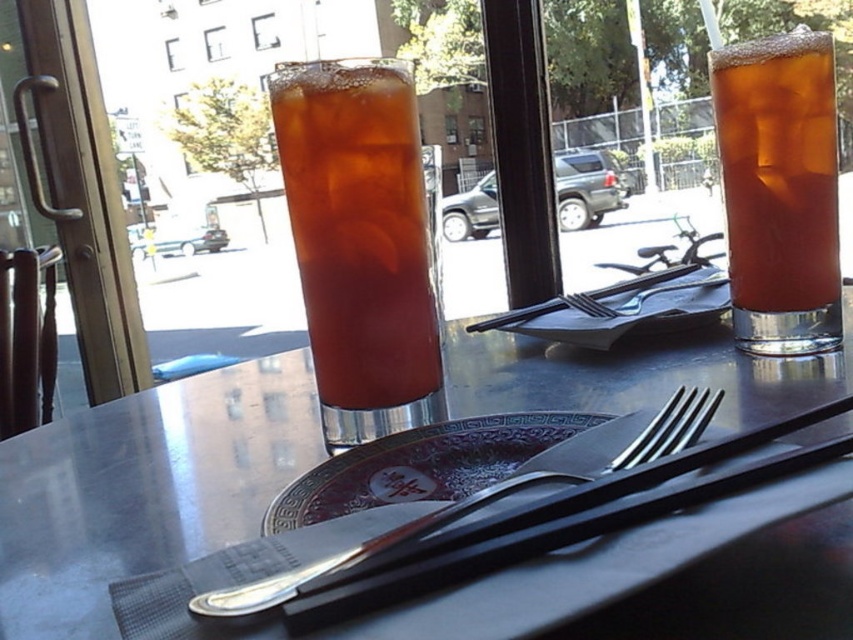
Question: Which point appears closest to the camera in this image?

Choices:
 (A) (718, 144)
 (B) (378, 544)
 (C) (413, 198)

Answer: (B)

Question: Based on their relative distances, which object is nearer to the brown matte glass at center?

Choices:
 (A) shiny silver fork at center
 (B) silver plated fork at center

Answer: (A)

Question: Can you confirm if shiny silver fork at center is wider than silver plated fork at center?

Choices:
 (A) no
 (B) yes

Answer: (B)

Question: Which point is farther to the camera?

Choices:
 (A) brown glass ice tea at upper right
 (B) shiny silver fork at center
 (C) silver plated fork at center
 (D) brown matte glass at center

Answer: (A)

Question: Is shiny silver fork at center smaller than silver plated fork at center?

Choices:
 (A) no
 (B) yes

Answer: (A)

Question: Is brown matte glass at center positioned in front of brown glass ice tea at upper right?

Choices:
 (A) no
 (B) yes

Answer: (B)